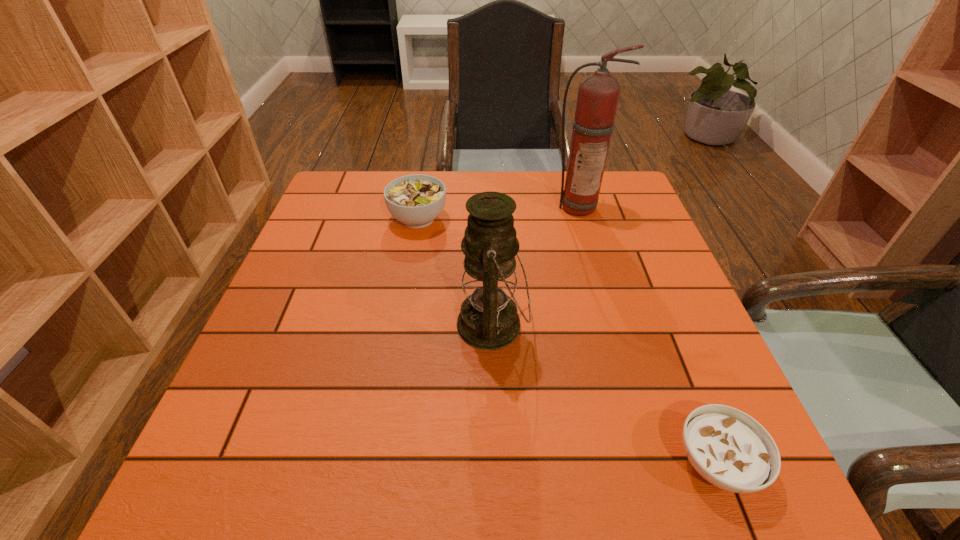
This screenshot has width=960, height=540. What are the coordinates of `vacant space situated 0.340m on the left of the shorter soup bowl` in the screenshot? It's located at (467, 463).

I want to click on fire extinguisher present at the far edge, so (598, 95).

Locate an element on the screen. The height and width of the screenshot is (540, 960). soup bowl positioned at the far edge is located at coordinates (416, 200).

Identify the location of object located in the near edge section of the desktop. (727, 447).

This screenshot has width=960, height=540. In order to click on fire extinguisher that is at the right edge in this screenshot , I will do `click(598, 95)`.

Locate an element on the screen. soup bowl located in the right edge section of the desktop is located at coordinates (727, 447).

The width and height of the screenshot is (960, 540). I want to click on object that is positioned at the far right corner, so click(x=598, y=95).

I want to click on object present at the near right corner, so click(727, 447).

Where is `free space at the far edge of the desktop`? free space at the far edge of the desktop is located at coordinates (442, 174).

Image resolution: width=960 pixels, height=540 pixels. I want to click on free region at the near edge of the desktop, so click(516, 456).